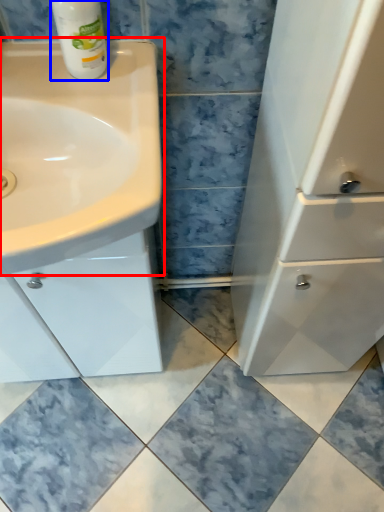
Question: Which of the following is the closest to the observer, sink (highlighted by a red box) or cleaning product (highlighted by a blue box)?

Choices:
 (A) sink
 (B) cleaning product

Answer: (A)